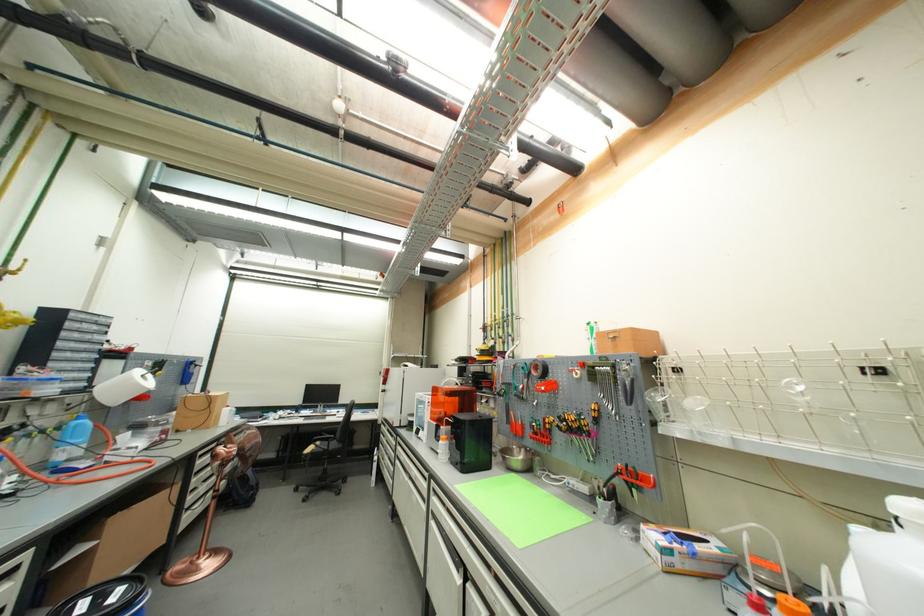
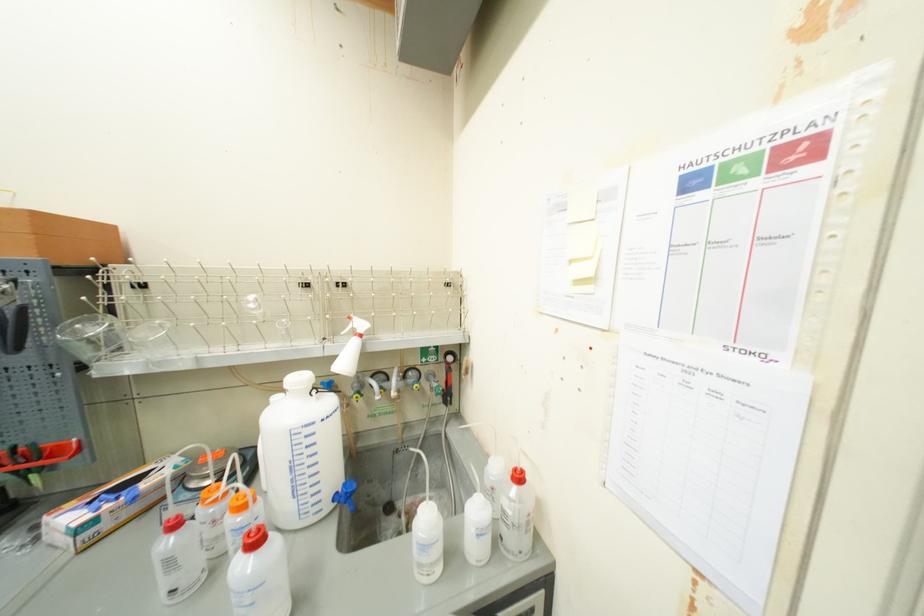
Question: I am providing you with two images of the same scene from different viewpoints. Please identify which objects are invisible in image2.

Choices:
 (A) white squeeze bottle
 (B) large white jug
 (C) glass beaker
 (D) none of these

Answer: (D)